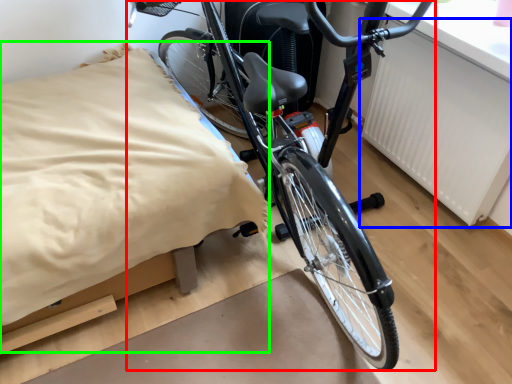
Question: Considering the real-world distances, which object is closest to bicycle (highlighted by a red box)? radiator (highlighted by a blue box) or sheet (highlighted by a green box).

Choices:
 (A) radiator
 (B) sheet

Answer: (B)